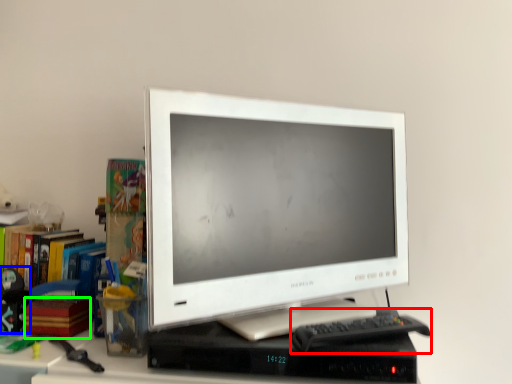
Question: Considering the real-world distances, which object is closest to keyboard (highlighted by a red box)? toy (highlighted by a blue box) or paperback book (highlighted by a green box).

Choices:
 (A) toy
 (B) paperback book

Answer: (B)